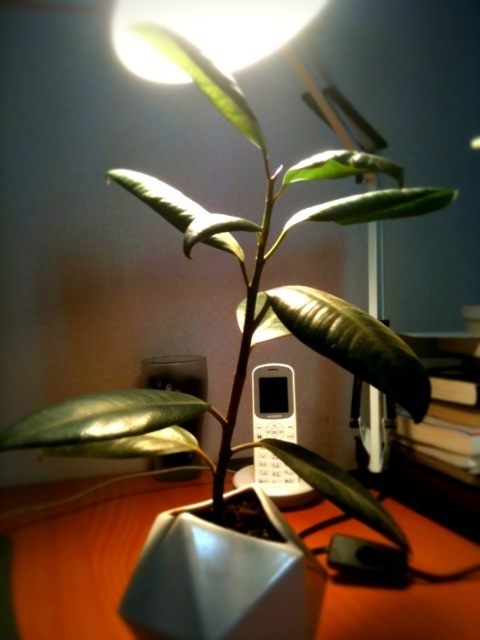
You are organizing items on the wooden table at center and the white plastic phone at center. If you want to place the phone closer to the right edge of the table, which direction should you move it?

The wooden table at center is to the left of the white plastic phone at center, so to move the phone closer to the right edge of the table, you should move it to the right.